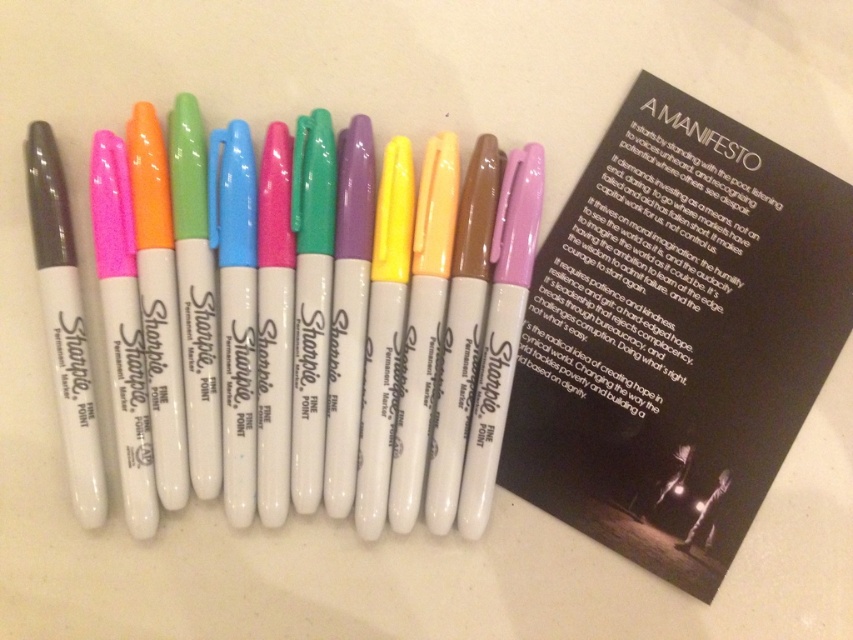
Is matte white marker at center closer to camera compared to matte gray pen at left?

No, it is not.

Based on the photo, between matte white marker at center and matte gray pen at left, which one appears on the right side from the viewer's perspective?

Positioned to the right is matte white marker at center.

Does point (262, 323) come in front of point (51, 163)?

No, it is behind (51, 163).

You are a GUI agent. You are given a task and a screenshot of the screen. Output one action in this format:
    pyautogui.click(x=<x>, y=<y>)
    Task: Click on the matte white marker at center
    This screenshot has width=853, height=640.
    Given the screenshot: What is the action you would take?
    pyautogui.click(x=335, y=317)